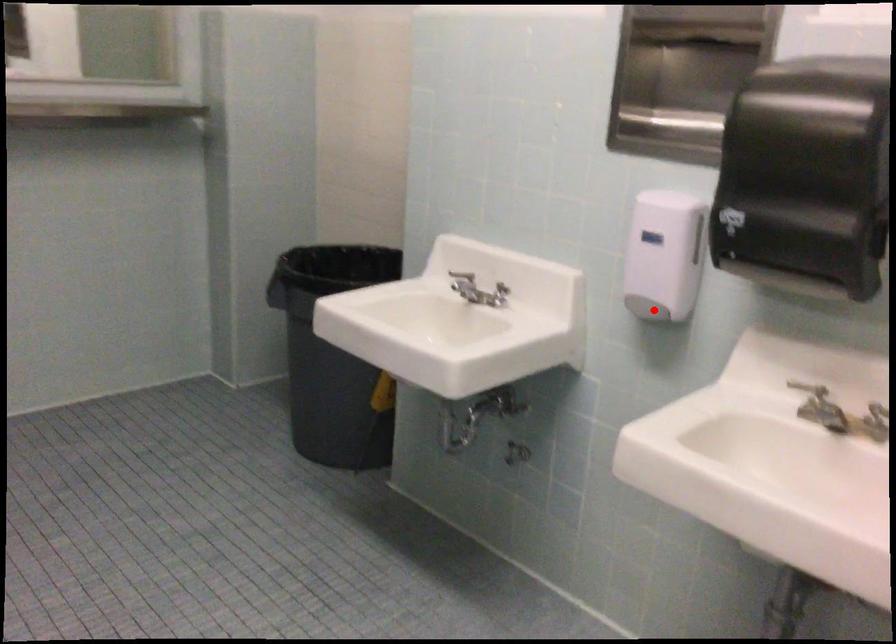
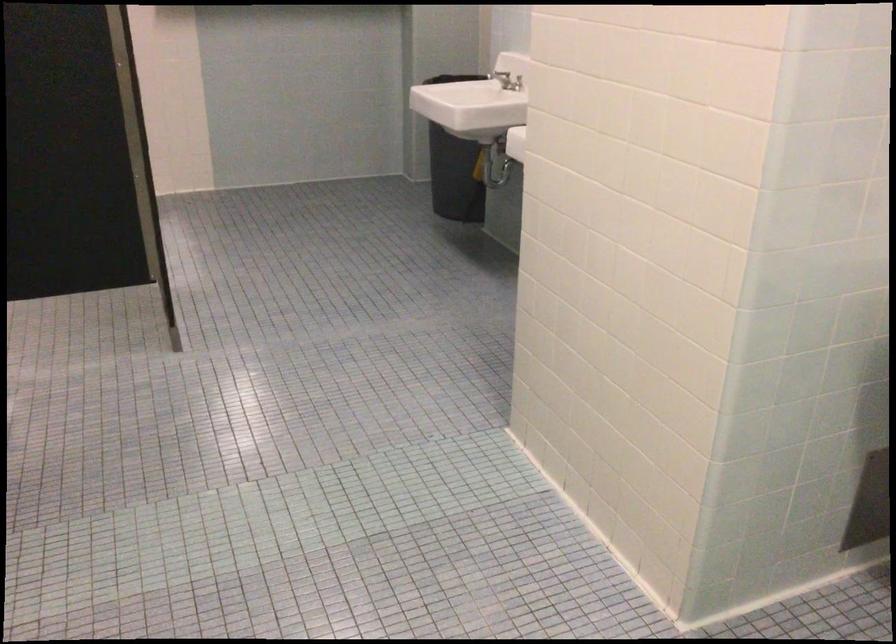
Question: I am providing you with two images of the same scene from different viewpoints. A red point is marked on the first image. Is the red point's position out of view in image 2?

Choices:
 (A) Yes
 (B) No

Answer: (A)